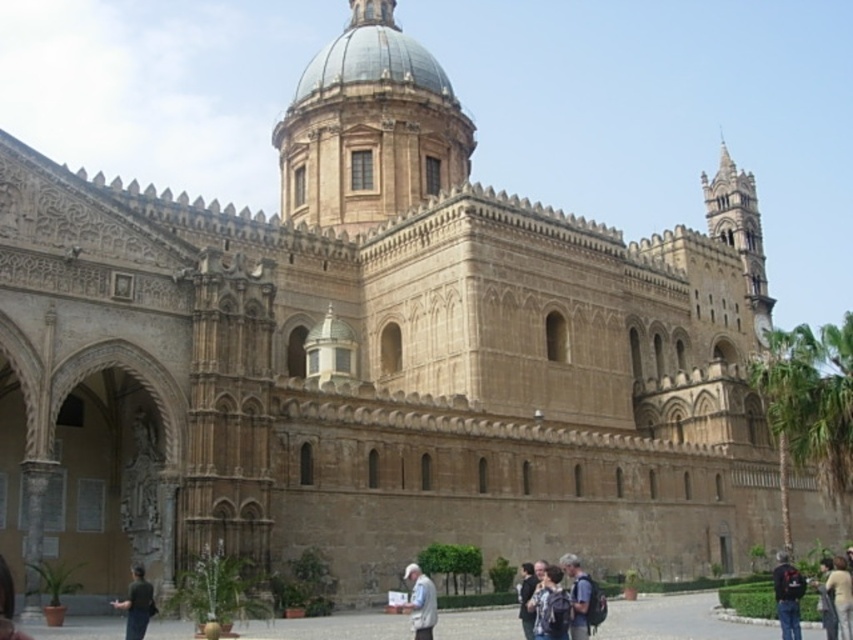
You are standing in front of the grand historical building and see a point at coordinate (578,595). What object is located at that point?

The point at coordinate (578,595) corresponds to the dark gray backpack at center.

You are a tourist visiting the cathedral and need to place your dark gray backpack at center and dark gray fabric jacket at lower left in your hotel room. The hotel room has a narrow closet that can only accommodate items narrower than 30 cm. Which item can fit in the closet?

The dark gray backpack at center has a width less than the dark gray fabric jacket at lower left. Since the backpack is narrower, it can fit in the closet if its width is under 30 cm. The jacket may be too wide.

You are a tourist visiting the cathedral and have both the black fabric backpack at lower right and the light brown leather jacket at lower right with you. You want to place them on the ground near the entrance. Which item will take up less space?

The black fabric backpack at lower right is smaller than the light brown leather jacket at lower right, so it will take up less space.